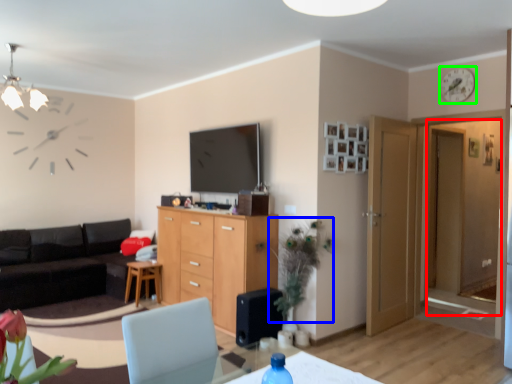
Question: Considering the real-world distances, which object is closest to glass door (highlighted by a red box)? floral arrangement (highlighted by a blue box) or clock (highlighted by a green box).

Choices:
 (A) floral arrangement
 (B) clock

Answer: (B)